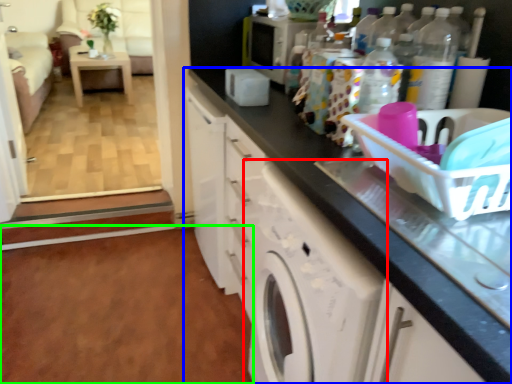
Question: Considering the real-world distances, which object is farthest from washing machine (highlighted by a red box)? cabinetry (highlighted by a blue box) or plain (highlighted by a green box)?

Choices:
 (A) cabinetry
 (B) plain

Answer: (B)